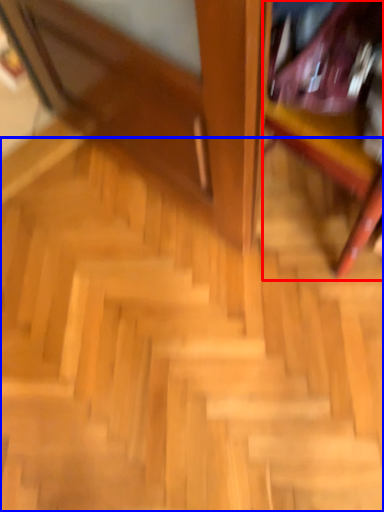
Question: Which point is further to the camera, furniture (highlighted by a red box) or stairs (highlighted by a blue box)?

Choices:
 (A) furniture
 (B) stairs

Answer: (B)